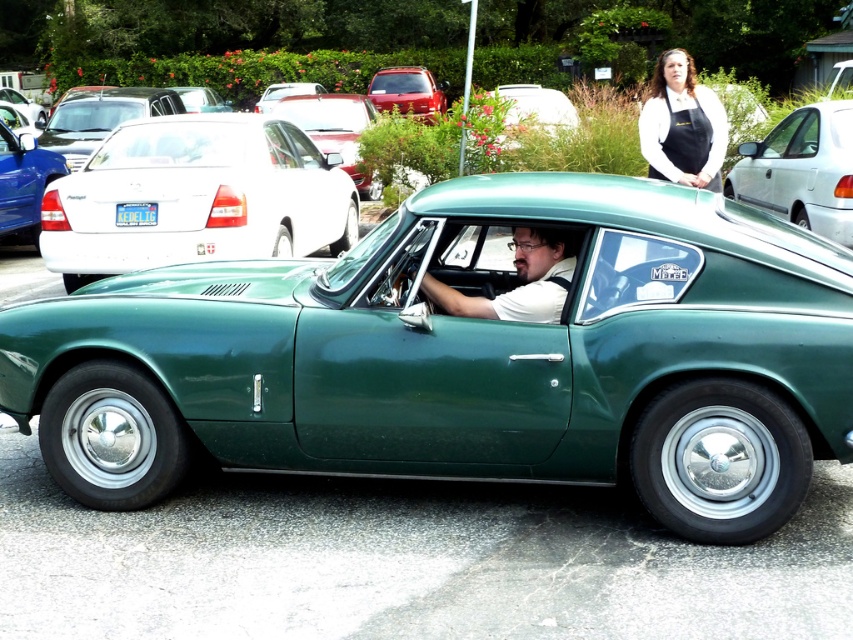
You are a delivery person needing to park your van next to the matte white sedan at center and the black apron at upper center. Which object should you park closer to if you want to avoid blocking the entrance which is near the smaller object?

You should park closer to the black apron at upper center because it is smaller than the matte white sedan at center, so the entrance near the black apron at upper center is less likely to be blocked by a larger vehicle.

Looking at this image, you are a parking attendant trying to fit a new car into the parking space between the green metallic car at center and the green matte car at center. Based on the information provided, can you determine if there is enough space between them to park another vehicle?

The green metallic car at center might be wider than green matte car at center. Since their widths are uncertain, it is not possible to determine if there is enough space between them to park another vehicle without knowing the exact dimensions of both cars and the parking space.

You are standing in front of the vintage green sports car and want to take a photo. You notice two points marked on the car. One is at point (555, 321) and the other is at point (544, 102). Which point is closer to you when you take the photo?

Point (555, 321) is closer to the camera than point (544, 102), so it is the point closer to you when taking the photo.